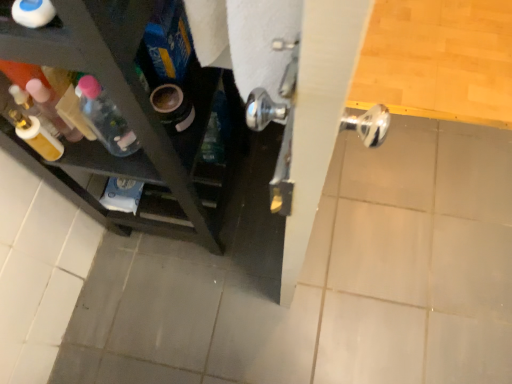
Question: From a real-world perspective, is white glossy bottle at upper left, placed as the third bottle when sorted from left to right, on translucent plastic bottle at left, the 2th bottle when ordered from back to front?

Choices:
 (A) yes
 (B) no

Answer: (A)

Question: Is white glossy bottle at upper left, which ranks as the third bottle in back-to-front order, far from translucent plastic bottle at left, arranged as the 1th bottle when viewed from the left?

Choices:
 (A) yes
 (B) no

Answer: (B)

Question: From a real-world perspective, is white glossy bottle at upper left, the 1th bottle viewed from the right, located beneath translucent plastic bottle at left, the 3th bottle viewed from the right?

Choices:
 (A) yes
 (B) no

Answer: (B)

Question: From the image's perspective, is white glossy bottle at upper left, placed as the third bottle when sorted from left to right, over translucent plastic bottle at left, arranged as the 1th bottle when viewed from the left?

Choices:
 (A) no
 (B) yes

Answer: (B)

Question: Is white glossy bottle at upper left, acting as the first bottle starting from the front, turned away from translucent plastic bottle at left, the 2th bottle when ordered from back to front?

Choices:
 (A) no
 (B) yes

Answer: (A)

Question: Does point (45, 1) appear closer or farther from the camera than point (51, 89)?

Choices:
 (A) closer
 (B) farther

Answer: (A)

Question: Considering the positions of white glossy bottle at upper left, which ranks as the third bottle in back-to-front order, and translucent plastic bottle at left, the 3th bottle viewed from the right, in the image, is white glossy bottle at upper left, which ranks as the third bottle in back-to-front order, bigger or smaller than translucent plastic bottle at left, the 3th bottle viewed from the right,?

Choices:
 (A) big
 (B) small

Answer: (B)

Question: From a real-world perspective, is white glossy bottle at upper left, acting as the first bottle starting from the front, positioned above or below translucent plastic bottle at left, arranged as the 1th bottle when viewed from the left?

Choices:
 (A) above
 (B) below

Answer: (A)

Question: Considering the positions of white glossy bottle at upper left, placed as the third bottle when sorted from left to right, and translucent plastic bottle at left, the 2th bottle when ordered from back to front, in the image, is white glossy bottle at upper left, placed as the third bottle when sorted from left to right, wider or thinner than translucent plastic bottle at left, the 2th bottle when ordered from back to front,?

Choices:
 (A) wide
 (B) thin

Answer: (B)

Question: Considering the positions of translucent plastic bottle at left, the 2th bottle when ordered from right to left, and white glossy bottle at upper left, placed as the third bottle when sorted from left to right, in the image, is translucent plastic bottle at left, the 2th bottle when ordered from right to left, bigger or smaller than white glossy bottle at upper left, placed as the third bottle when sorted from left to right,?

Choices:
 (A) big
 (B) small

Answer: (A)

Question: From the image's perspective, is translucent plastic bottle at left, which is the first bottle from back to front, positioned above or below white glossy bottle at upper left, acting as the first bottle starting from the front?

Choices:
 (A) below
 (B) above

Answer: (A)

Question: In terms of width, does translucent plastic bottle at left, the 2th bottle when ordered from right to left, look wider or thinner when compared to white glossy bottle at upper left, acting as the first bottle starting from the front?

Choices:
 (A) wide
 (B) thin

Answer: (A)

Question: From a real-world perspective, is translucent plastic bottle at left, which ranks as the 2th bottle in left-to-right order, positioned above or below white glossy bottle at upper left, placed as the third bottle when sorted from left to right?

Choices:
 (A) above
 (B) below

Answer: (B)

Question: Relative to translucent plastic bottle at left, the 2th bottle in the front-to-back sequence, is translucent plastic bottle at left, which is the 3th bottle in front-to-back order, in front or behind?

Choices:
 (A) behind
 (B) front

Answer: (A)

Question: Is translucent plastic bottle at left, which is the 3th bottle in front-to-back order, bigger or smaller than translucent plastic bottle at left, the 3th bottle viewed from the right?

Choices:
 (A) small
 (B) big

Answer: (A)